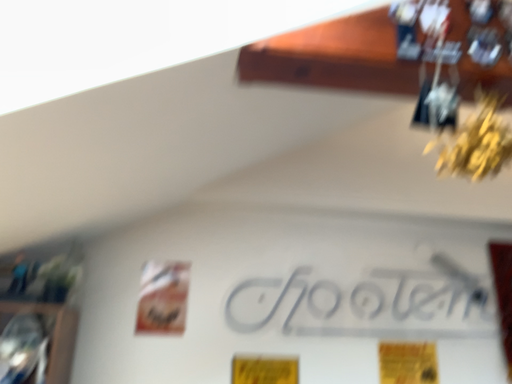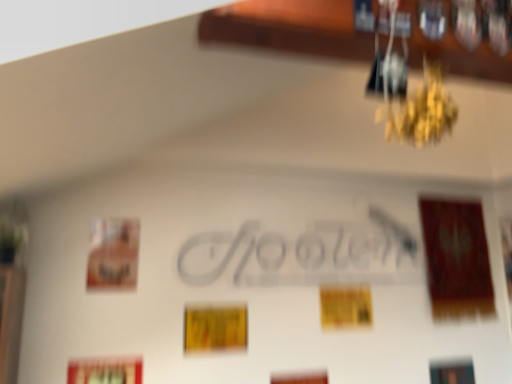
Question: How did the camera likely rotate when shooting the video?

Choices:
 (A) rotated downward
 (B) rotated upward

Answer: (A)